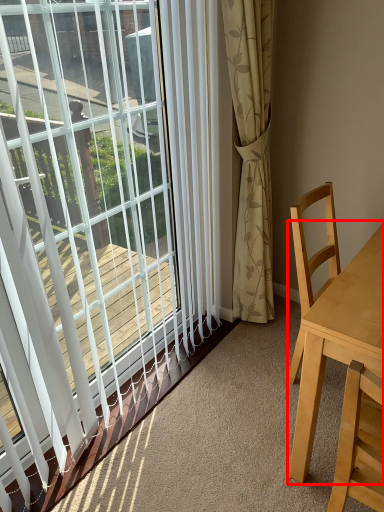
Question: From the image's perspective, what is the correct spatial relationship of table (annotated by the red box) in relation to window?

Choices:
 (A) above
 (B) below

Answer: (B)